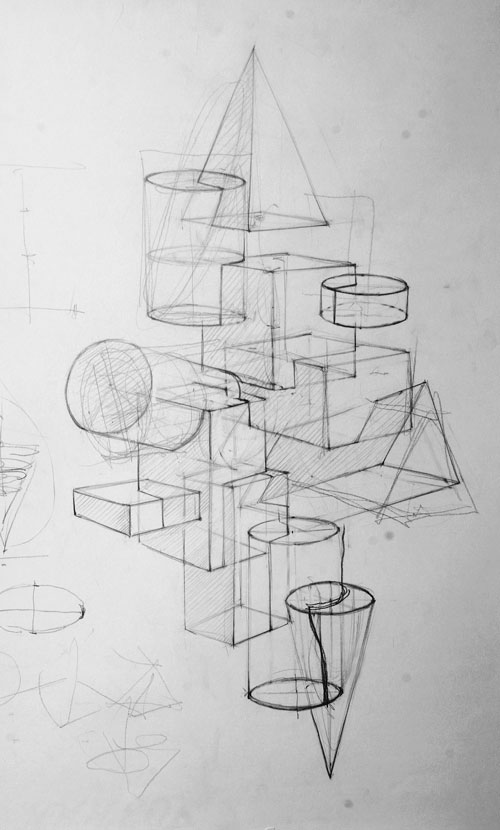
This screenshot has width=500, height=830. I want to click on corner, so click(277, 274), click(238, 636), click(134, 508).